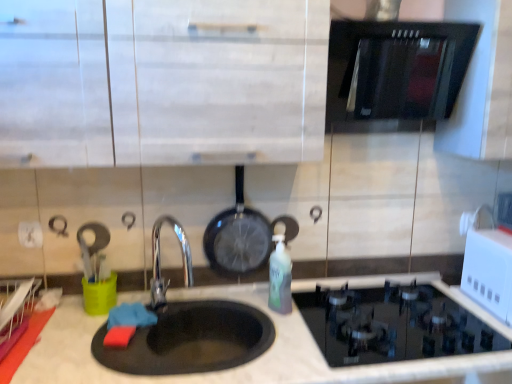
Where is `free space above white marble countertop at center (from a real-world perspective)`? The height and width of the screenshot is (384, 512). free space above white marble countertop at center (from a real-world perspective) is located at coordinates (278, 322).